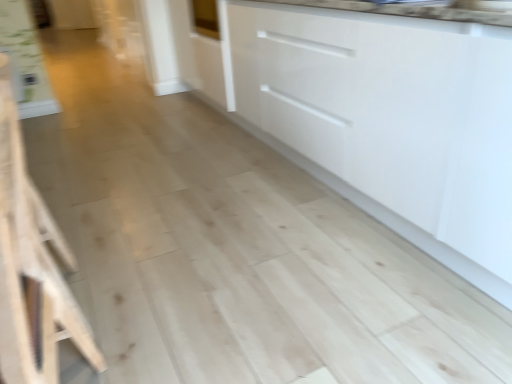
Question: Is white glossy cabinet at center bigger or smaller than light wood stool at left?

Choices:
 (A) big
 (B) small

Answer: (A)

Question: From the image's perspective, is white glossy cabinet at center located above or below light wood stool at left?

Choices:
 (A) above
 (B) below

Answer: (A)

Question: From their relative heights in the image, would you say white glossy cabinet at center is taller or shorter than light wood stool at left?

Choices:
 (A) tall
 (B) short

Answer: (A)

Question: Is light wood stool at left inside the boundaries of white glossy cabinet at center, or outside?

Choices:
 (A) outside
 (B) inside

Answer: (A)

Question: Considering the relative positions of light wood stool at left and white glossy cabinet at center in the image provided, is light wood stool at left to the left or to the right of white glossy cabinet at center?

Choices:
 (A) right
 (B) left

Answer: (B)

Question: From the image's perspective, is light wood stool at left positioned above or below white glossy cabinet at center?

Choices:
 (A) below
 (B) above

Answer: (A)

Question: Looking at the image, does light wood stool at left seem bigger or smaller compared to white glossy cabinet at center?

Choices:
 (A) small
 (B) big

Answer: (A)